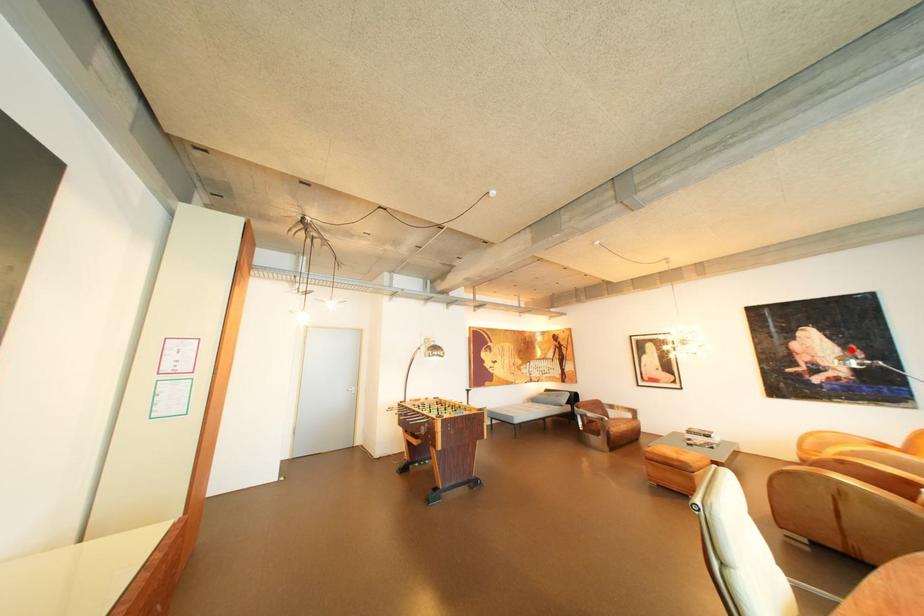
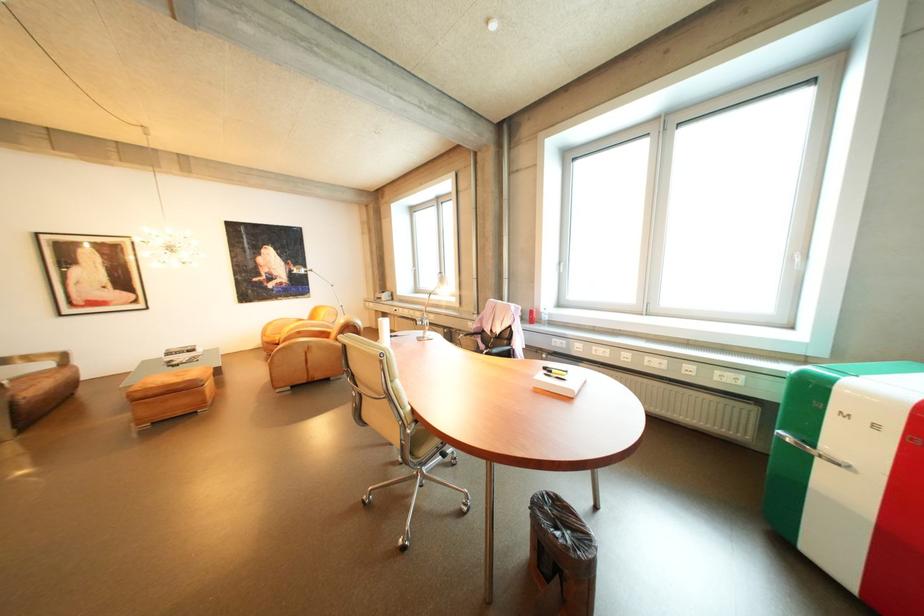
Question: I am providing you with two images of the same scene from different viewpoints. In image1, a red point is highlighted. Considering the same 3D point in image2, which of the following is correct?

Choices:
 (A) It is closer
 (B) It is farther

Answer: (B)